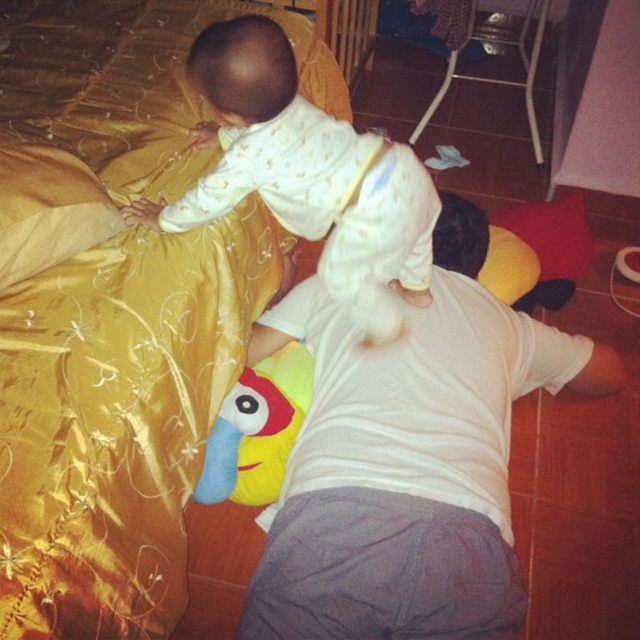
Question: Which point is farther from the camera taking this photo?

Choices:
 (A) (304, 337)
 (B) (301, 376)
 (C) (266, 157)

Answer: (A)

Question: Considering the real-world distances, which object is farthest from the gold satin bed at upper left?

Choices:
 (A) white cotton shirt at center
 (B) soft plush toy at center

Answer: (A)

Question: Is white soft onesie at upper center closer to camera compared to soft plush toy at center?

Choices:
 (A) yes
 (B) no

Answer: (A)

Question: Can you confirm if gold satin bed at upper left is thinner than white cotton shirt at center?

Choices:
 (A) yes
 (B) no

Answer: (B)

Question: Which of the following is the farthest from the observer?

Choices:
 (A) gold satin pillow at upper left
 (B) soft plush toy at center
 (C) gold satin bed at upper left

Answer: (B)

Question: Can you confirm if white soft onesie at upper center is wider than gold satin pillow at upper left?

Choices:
 (A) no
 (B) yes

Answer: (B)